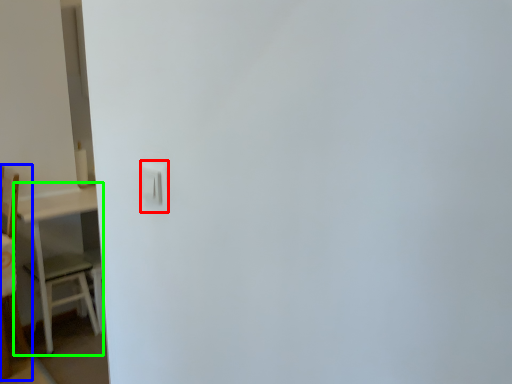
Question: Estimate the real-world distances between objects in this image. Which object is closer to light switch (highlighted by a red box), furniture (highlighted by a blue box) or table (highlighted by a green box)?

Choices:
 (A) furniture
 (B) table

Answer: (A)